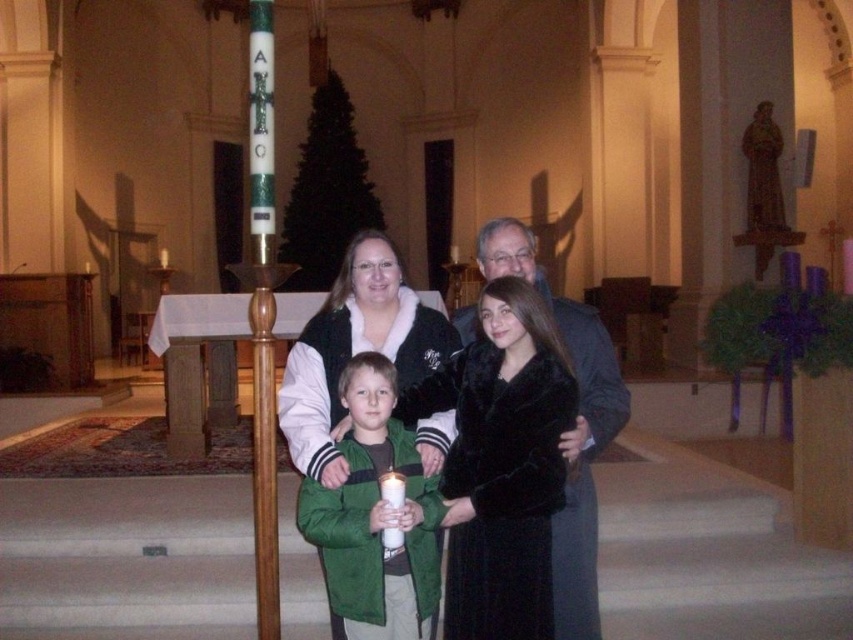
You are a photographer adjusting the lighting in the church. You notice the black fur coat at center and the green fuzzy jacket at center. Which one is positioned lower in the image?

The black fur coat at center is located below the green fuzzy jacket at center, so it is positioned lower in the image.

You are a photographer trying to decide which coat to feature in your next photo shoot. You have two coats available for the shoot, the black fur coat at center and the velvet gray coat at center. Based on their sizes, which coat would you choose if you want to emphasize a bold and commanding presence in the image?

The black fur coat at center has a larger size compared to the velvet gray coat at center, so it would be the better choice to emphasize a bold and commanding presence due to its larger size.